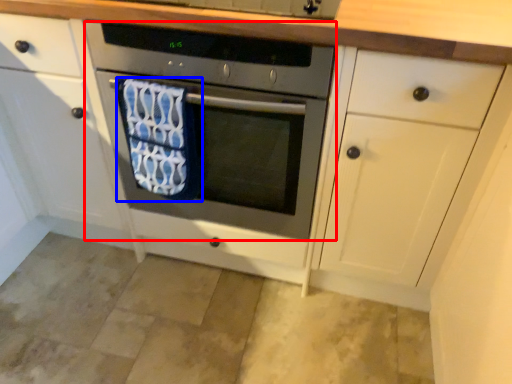
Question: Which of the following is the farthest to the observer, oven (highlighted by a red box) or beach towel (highlighted by a blue box)?

Choices:
 (A) oven
 (B) beach towel

Answer: (B)